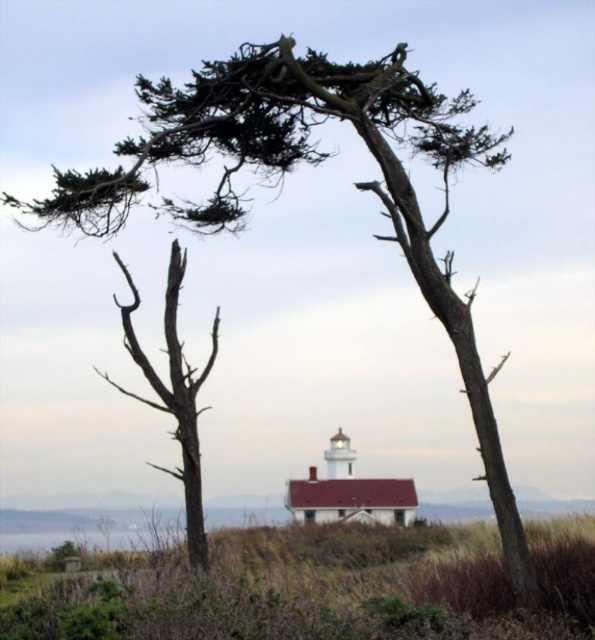
Question: Which point is farther from the camera taking this photo?

Choices:
 (A) (102, 532)
 (B) (205, 554)

Answer: (A)

Question: Is bare wood tree at left below transparent water at lower left?

Choices:
 (A) yes
 (B) no

Answer: (B)

Question: Can you confirm if bare wood tree at left is positioned above transparent water at lower left?

Choices:
 (A) no
 (B) yes

Answer: (B)

Question: Which point is farther from the camera taking this photo?

Choices:
 (A) (195, 506)
 (B) (20, 550)

Answer: (B)

Question: In this image, where is bare wood tree at left located relative to transparent water at lower left?

Choices:
 (A) right
 (B) left

Answer: (A)